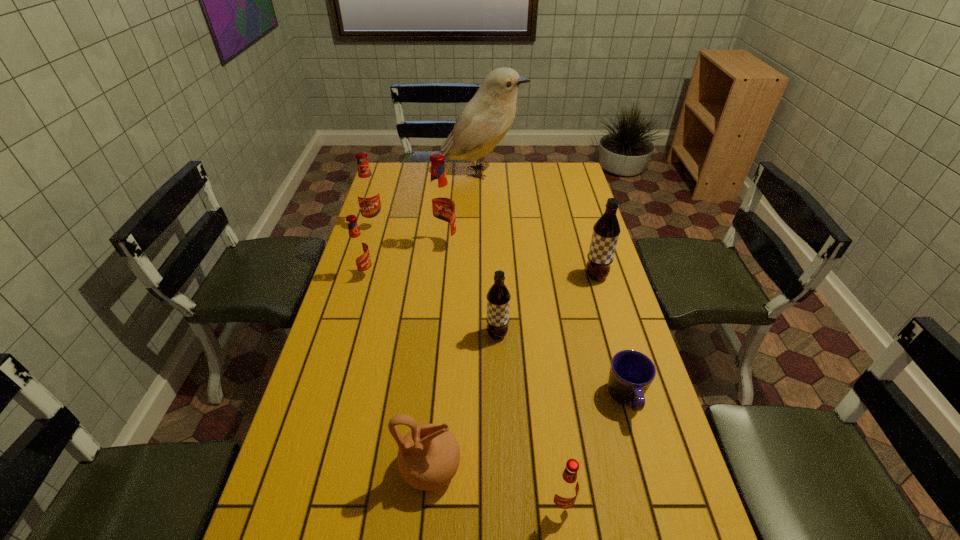
The height and width of the screenshot is (540, 960). What are the coordinates of `the nearer brown root beer` in the screenshot? It's located at (498, 297).

Find the location of a particular element. This screenshot has height=540, width=960. pottery is located at coordinates (428, 457).

Locate an element on the screen. This screenshot has width=960, height=540. the nearest red root beer is located at coordinates (566, 487).

The width and height of the screenshot is (960, 540). I want to click on the rightmost red root beer, so [x=566, y=487].

I want to click on the shortest object, so click(x=631, y=373).

Image resolution: width=960 pixels, height=540 pixels. Find the location of `black mug`. black mug is located at coordinates (631, 373).

Identify the location of free location located 0.110m on the face of the farthest object. Image resolution: width=960 pixels, height=540 pixels. (548, 172).

Locate an element on the screen. free space located on the back of the second farthest root beer is located at coordinates (446, 217).

Where is `free space located 0.270m on the back of the farthest red root beer`? Image resolution: width=960 pixels, height=540 pixels. free space located 0.270m on the back of the farthest red root beer is located at coordinates (387, 184).

What are the coordinates of `vacant region located 0.170m on the front of the rightmost root beer` in the screenshot? It's located at (610, 323).